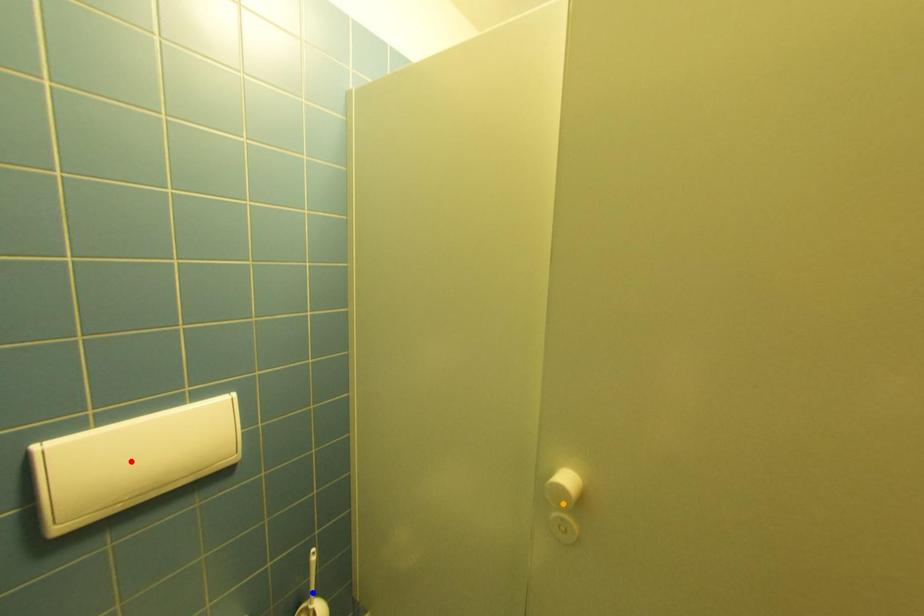
Order these from nearest to farthest:
red point | orange point | blue point

red point → orange point → blue point